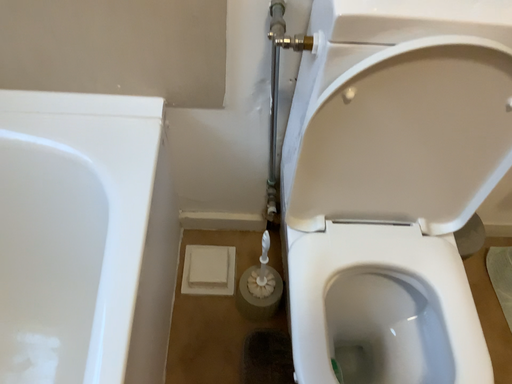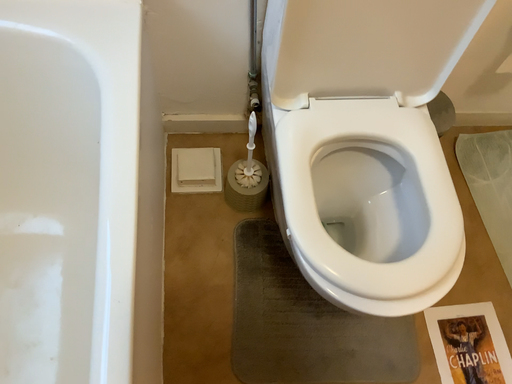
Question: How did the camera likely rotate when shooting the video?

Choices:
 (A) rotated downward
 (B) rotated upward

Answer: (A)